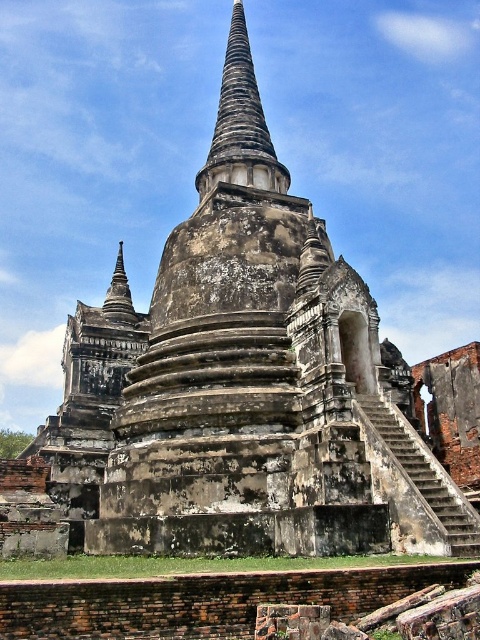
You are a visitor at the temple and want to take a photo of the weathered stone spire at center and the dark brown stone spire at upper left. Which spire should you focus on first if you want to capture both in one frame without moving the camera?

The weathered stone spire at center is larger in size compared to the dark brown stone spire at upper left, so you should focus on the weathered stone spire at center first to ensure it fits properly in the frame.

You are standing at the base of the historic temple stupa and looking up. You notice a point marked at coordinates (x=240, y=124). Based on the stupa structure described, where is this point located?

The point at (x=240, y=124) is located at the weathered stone spire at the center of the stupa.

You are standing in front of the historic temple stupa and notice two points marked on the ground. One is at point (238, 92) and the other at point (116, 321). Which point is closer to your current position?

Point (238, 92) is further to the camera than point (116, 321), so the point closer to your current position is point (116, 321).